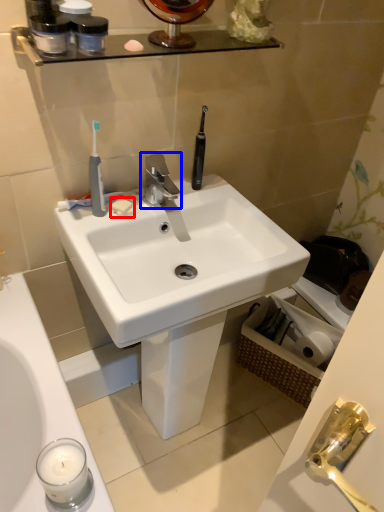
Question: Which point is further to the camera, soap (highlighted by a red box) or tap (highlighted by a blue box)?

Choices:
 (A) soap
 (B) tap

Answer: (A)